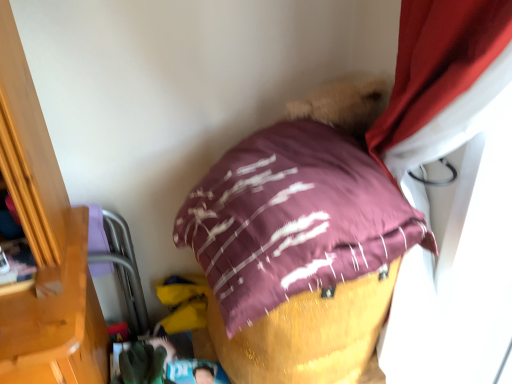
Question: From the image's perspective, is purple fabric bean bag at left positioned above or below green fabric glove at lower center?

Choices:
 (A) above
 (B) below

Answer: (A)

Question: Is point (142, 311) closer or farther from the camera than point (143, 360)?

Choices:
 (A) farther
 (B) closer

Answer: (A)

Question: Which is farther from the green fabric glove at lower center?

Choices:
 (A) purple fabric bean bag at left
 (B) maroon satin pillow at center

Answer: (B)

Question: Based on their relative distances, which object is nearer to the purple fabric bean bag at left?

Choices:
 (A) green fabric glove at lower center
 (B) maroon satin pillow at center

Answer: (A)